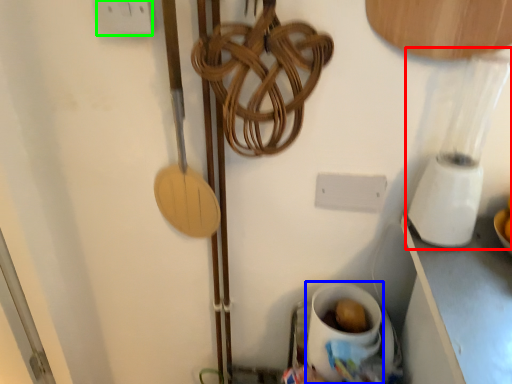
Question: Based on their relative distances, which object is farther from blender (highlighted by a red box)? Choose from coffee cup (highlighted by a blue box) and electric outlet (highlighted by a green box).

Choices:
 (A) coffee cup
 (B) electric outlet

Answer: (B)